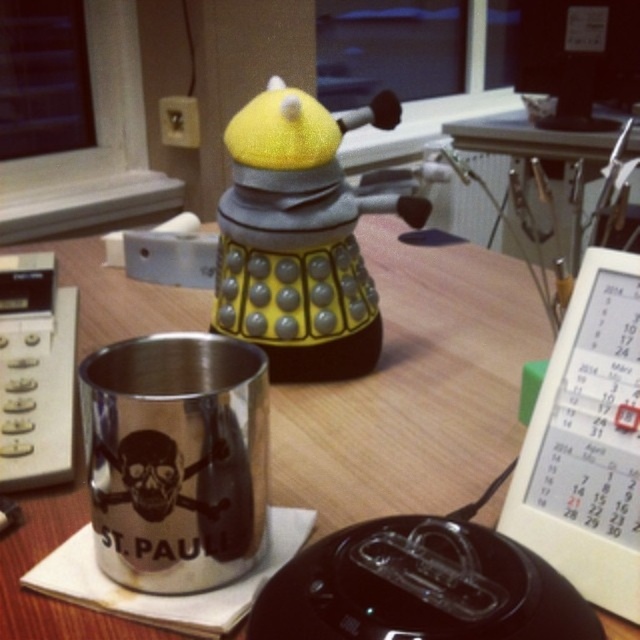
Is point (451, 236) farther from camera compared to point (100, 538)?

Yes, point (451, 236) is farther from viewer.

Which is in front, point (356, 460) or point (237, 481)?

Point (237, 481) is in front.

The width and height of the screenshot is (640, 640). What are the coordinates of `metallic silver cup at center-left` in the screenshot? It's located at (413, 387).